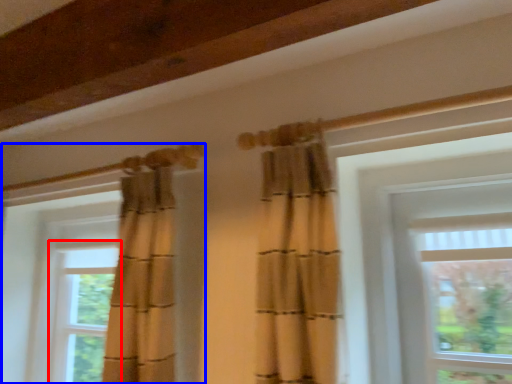
Question: Which object appears farthest to the camera in this image, window (highlighted by a red box) or window (highlighted by a blue box)?

Choices:
 (A) window
 (B) window

Answer: (A)